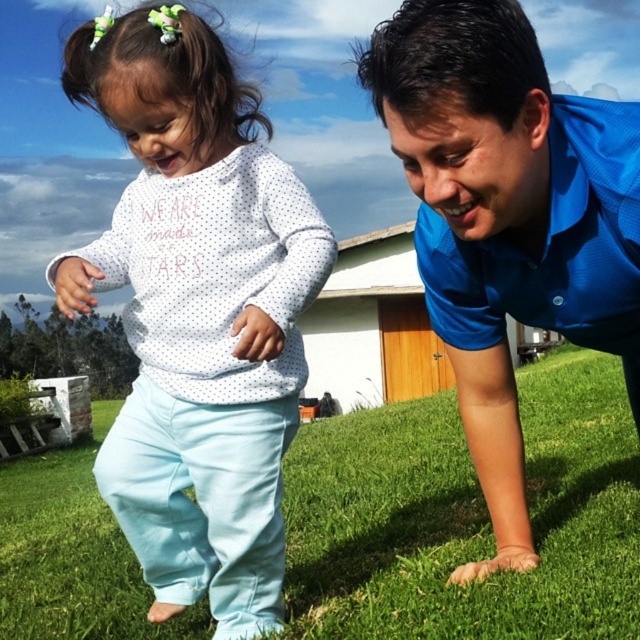
Which is above, white dotted sweater at center or green grass at lower center?

white dotted sweater at center

Is white dotted sweater at center thinner than green grass at lower center?

Yes, white dotted sweater at center is thinner than green grass at lower center.

Looking at this image, who is more distant from viewer, (250,586) or (88,452)?

Point (88,452)

Locate an element on the screen. This screenshot has width=640, height=640. white dotted sweater at center is located at coordinates (196, 312).

How far apart are green grass at lower center and blue smooth shirt at center?

The distance of green grass at lower center from blue smooth shirt at center is 6.66 feet.

Is green grass at lower center below blue smooth shirt at center?

Correct, green grass at lower center is located below blue smooth shirt at center.

Is point (17, 476) less distant than point (497, 88)?

No.

The width and height of the screenshot is (640, 640). What are the coordinates of `green grass at lower center` in the screenshot? It's located at (467, 516).

Is point (227, 324) behind point (545, 147)?

Yes, point (227, 324) is farther from viewer.

Can you confirm if white dotted sweater at center is taller than blue smooth shirt at center?

Correct, white dotted sweater at center is much taller as blue smooth shirt at center.

Who is more forward, (188, 509) or (483, 342)?

Point (483, 342) is more forward.

The image size is (640, 640). In order to click on white dotted sweater at center in this screenshot , I will do `click(196, 312)`.